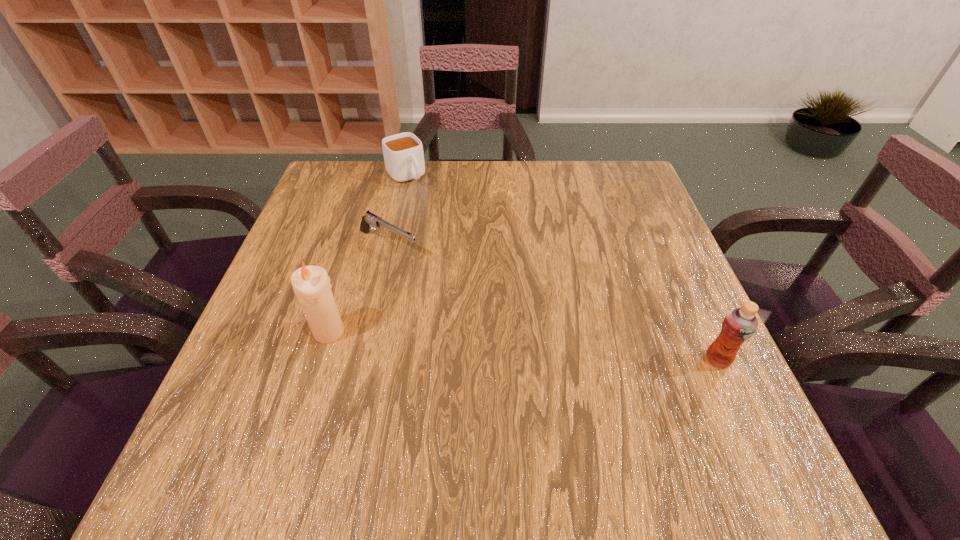
You are a GUI agent. You are given a task and a screenshot of the screen. Output one action in this format:
    pyautogui.click(x=<x>, y=<y>)
    Task: Click on the free spot on the desktop that is between the tallest object and the nearest object and is positioned on the front-facing side of the third nearest object
    
    Given the screenshot: What is the action you would take?
    pyautogui.click(x=573, y=349)

You are a GUI agent. You are given a task and a screenshot of the screen. Output one action in this format:
    pyautogui.click(x=<x>, y=<y>)
    Task: Click on the vacant spot on the desktop that is between the third farthest object and the third shortest object and is positioned on the side with the handle of the cup
    This screenshot has width=960, height=540.
    Given the screenshot: What is the action you would take?
    pyautogui.click(x=555, y=348)